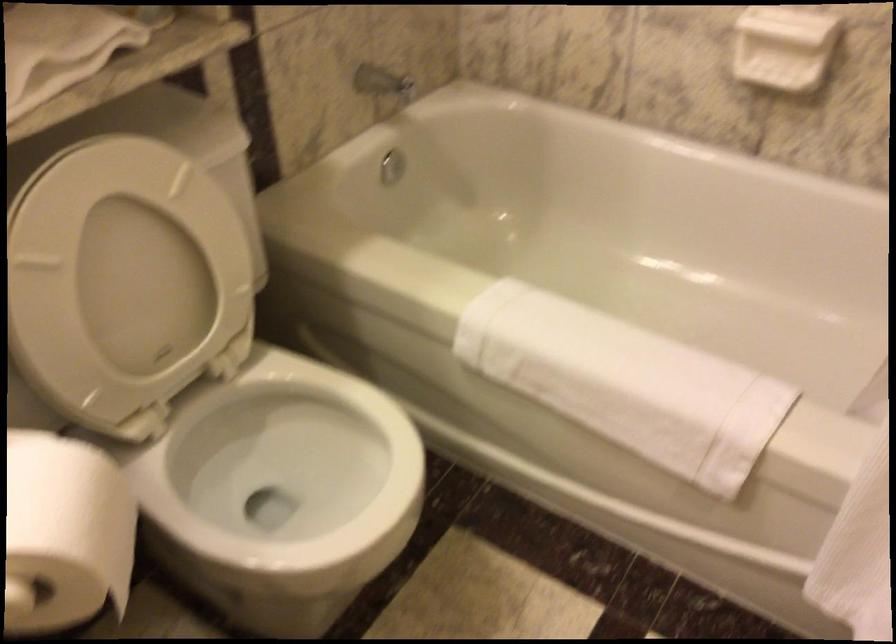
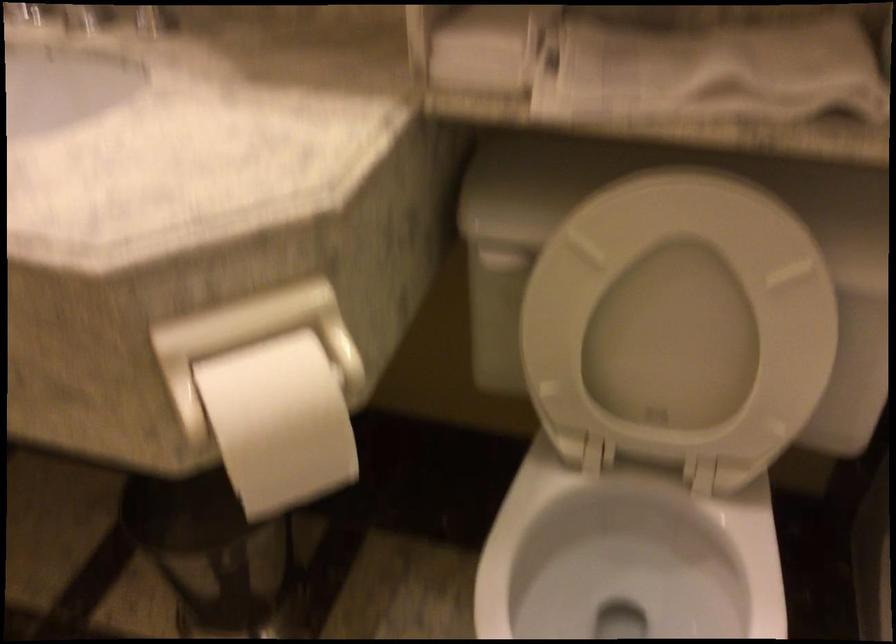
In the second image, find the point that corresponds to (131,278) in the first image.

(678, 322)